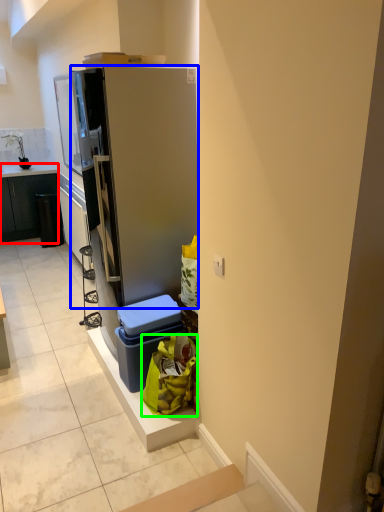
Question: Which object is the closest to the cabinetry (highlighted by a red box)? Choose among these: refrigerator (highlighted by a blue box) or garbage (highlighted by a green box).

Choices:
 (A) refrigerator
 (B) garbage

Answer: (A)